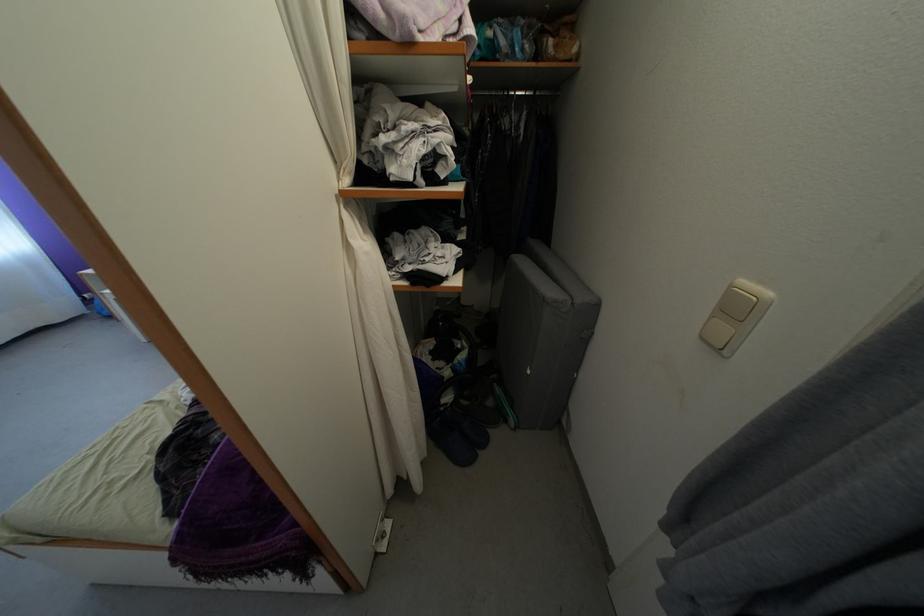
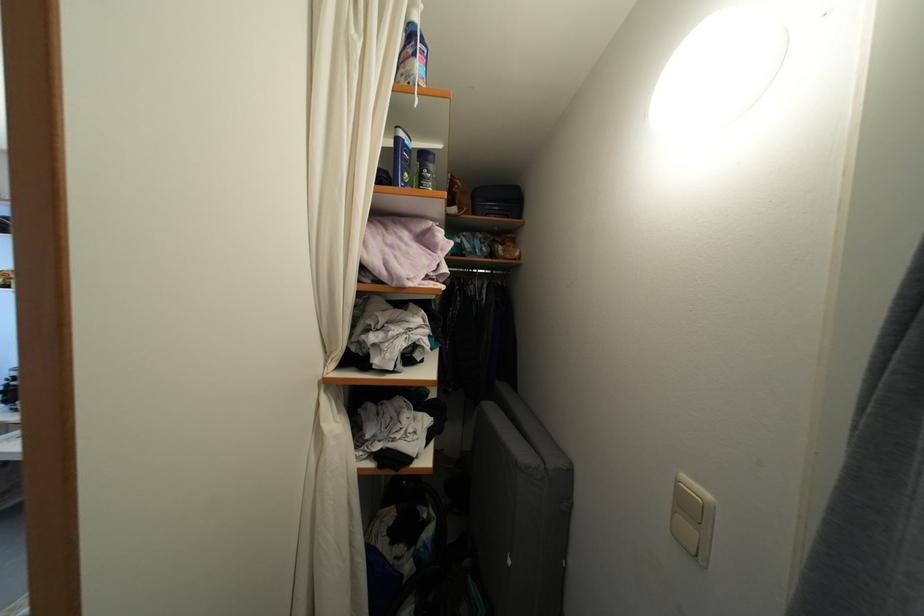
Question: How did the camera likely rotate?

Choices:
 (A) Left
 (B) Right
 (C) Up
 (D) Down

Answer: (C)